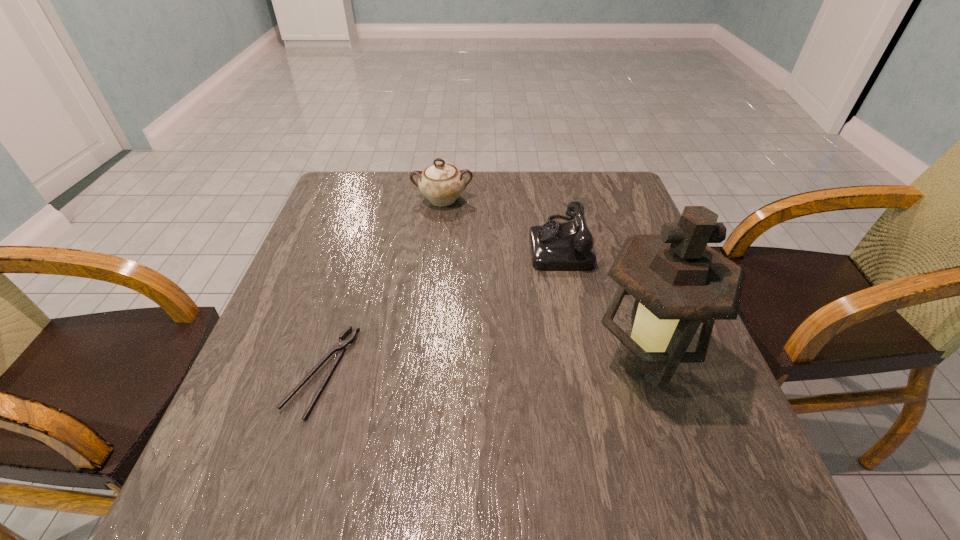
Locate an element on the screen. free area in between the oil lamp and the tongs is located at coordinates (482, 367).

Locate which object ranks third in proximity to the chinaware. Please provide its 2D coordinates. Your answer should be formatted as a tuple, i.e. [(x, y)], where the tuple contains the x and y coordinates of a point satisfying the conditions above.

[(678, 281)]

Find the location of `object that is the third closest to the third tallest object`. object that is the third closest to the third tallest object is located at coordinates (340, 346).

Find the location of a particular element. vacant region that satisfies the following two spatial constraints: 1. on the dial of the third nearest object; 2. on the right side of the tallest object is located at coordinates (584, 363).

I want to click on vacant space that satisfies the following two spatial constraints: 1. on the dial of the second shortest object; 2. on the back side of the oil lamp, so click(x=584, y=363).